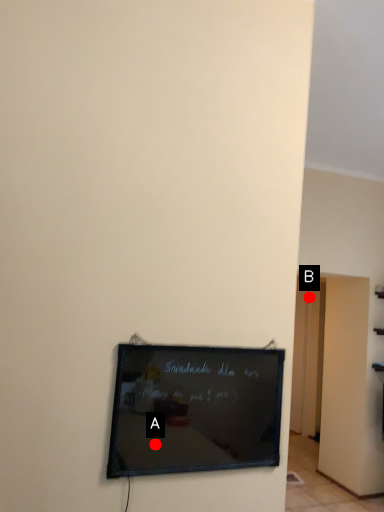
Question: Two points are circled on the image, labeled by A and B beside each circle. Which point is closer to the camera?

Choices:
 (A) A is closer
 (B) B is closer

Answer: (A)